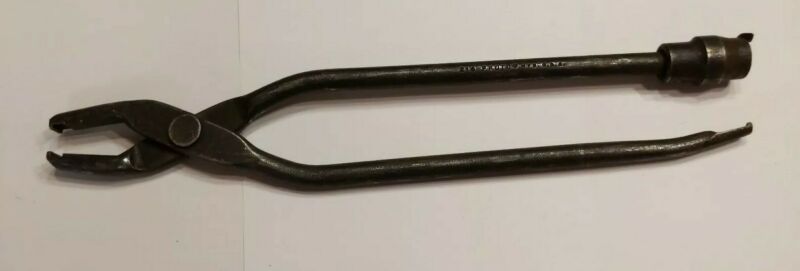
I want to click on white surface, so click(x=392, y=35).